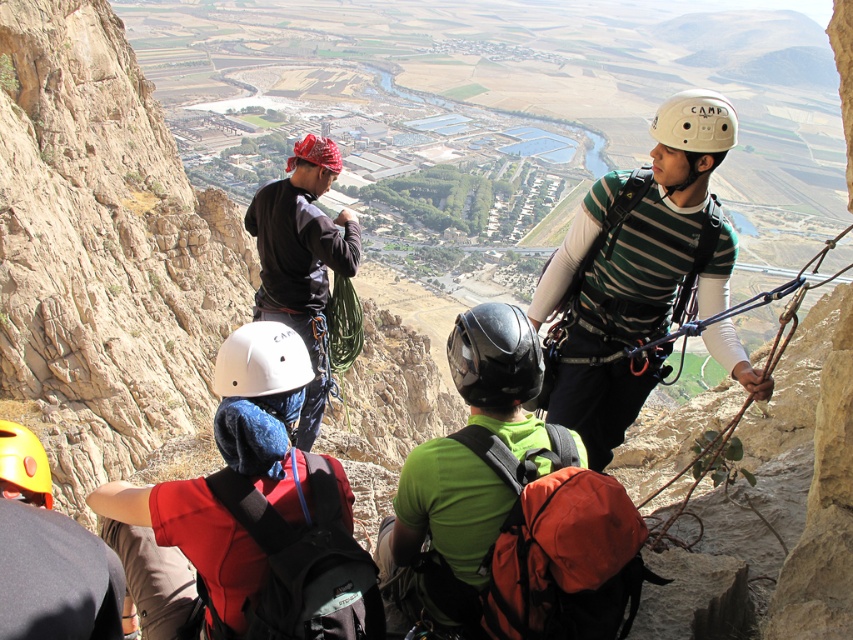
You are a safety inspector reviewing the climbing gear of two climbers. You notice the black matte helmet at center and the red fabric helmet at center. Which helmet has a greater thickness according to the safety specifications?

The black matte helmet at center is thinner than the red fabric helmet at center, so the red fabric helmet at center has greater thickness according to the safety specifications.

You are a safety inspector checking the climbing gear positions in the image. The safety regulations state that the harness must be positioned at the center of the climber. Is the dark gray fabric climbing harness at center correctly positioned according to the regulations?

The dark gray fabric climbing harness at center is positioned at point (x=302, y=259), which is the center of the climber, so it is correctly positioned according to the regulations.

You are a drone operator trying to capture a photo of the black matte helmet at center. The camera has a fixed focus point at point (494, 356). Will the camera focus on the black matte helmet at center?

The black matte helmet at center is located at point (494, 356), so yes, the camera will focus on the black matte helmet at center since the focus point matches its location.